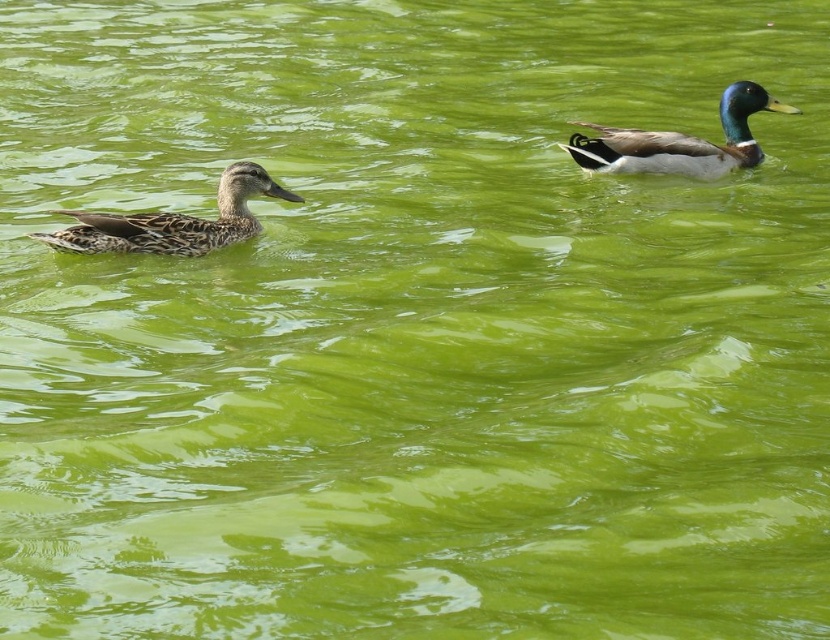
Question: Is speckled brown duck at left closer to the viewer compared to shiny green and brown duck at upper right?

Choices:
 (A) no
 (B) yes

Answer: (B)

Question: Which point is closer to the camera taking this photo?

Choices:
 (A) (47, 237)
 (B) (641, 161)

Answer: (A)

Question: Can you confirm if speckled brown duck at left is positioned below shiny green and brown duck at upper right?

Choices:
 (A) no
 (B) yes

Answer: (B)

Question: Does speckled brown duck at left have a smaller size compared to shiny green and brown duck at upper right?

Choices:
 (A) no
 (B) yes

Answer: (B)

Question: Which of the following is the farthest from the observer?

Choices:
 (A) (628, 164)
 (B) (198, 236)

Answer: (A)

Question: Which point is farther to the camera?

Choices:
 (A) (198, 227)
 (B) (709, 170)

Answer: (B)